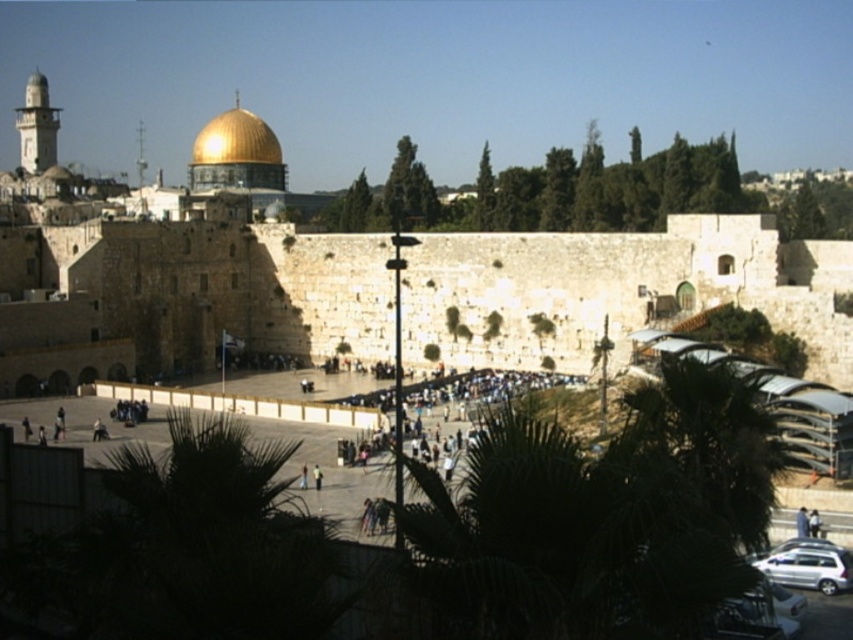
You are a tourist standing at the Western Wall Plaza. You notice the green leafy palm tree at lower left and the gold shiny dome at upper center. Which object has a narrower width?

The green leafy palm tree at lower left is thinner than the gold shiny dome at upper center, so the green leafy palm tree at lower left has a narrower width.

Consider the image. You are standing at the Western Wall Plaza and want to take a photo that includes both the point at coordinates point (x=132, y=531) and point (x=230, y=180). Since you want the closer point to be in focus, which point should you focus on?

You should focus on point (x=132, y=531) because it is closer to the viewer than point (x=230, y=180).